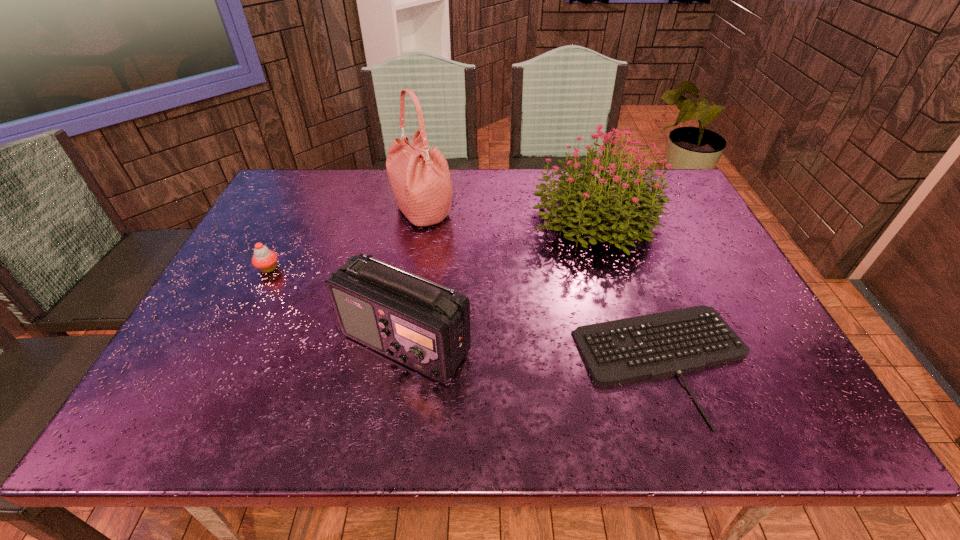
Where is `vacant area situated 0.140m on the left of the shortest object`? vacant area situated 0.140m on the left of the shortest object is located at coordinates pos(512,361).

Locate an element on the screen. handbag at the far edge is located at coordinates (420, 179).

Where is `bouquet situated at the far edge`? Image resolution: width=960 pixels, height=540 pixels. bouquet situated at the far edge is located at coordinates (586, 197).

Where is `object positioned at the near edge`? The height and width of the screenshot is (540, 960). object positioned at the near edge is located at coordinates (657, 345).

Where is `object situated at the left edge`? This screenshot has width=960, height=540. object situated at the left edge is located at coordinates coord(265,260).

You are a GUI agent. You are given a task and a screenshot of the screen. Output one action in this format:
    pyautogui.click(x=<x>, y=<y>)
    Task: Click on the bouquet present at the right edge
    
    Given the screenshot: What is the action you would take?
    pyautogui.click(x=586, y=197)

This screenshot has height=540, width=960. I want to click on computer keyboard at the right edge, so click(657, 345).

Identify the location of object at the far right corner. (586, 197).

At what (x,y) coordinates should I click in order to perform the action: click on object that is at the near right corner. Please return your answer as a coordinate pair (x, y). Image resolution: width=960 pixels, height=540 pixels. Looking at the image, I should click on (657, 345).

The image size is (960, 540). Identify the location of free space at the far edge of the desktop. (488, 201).